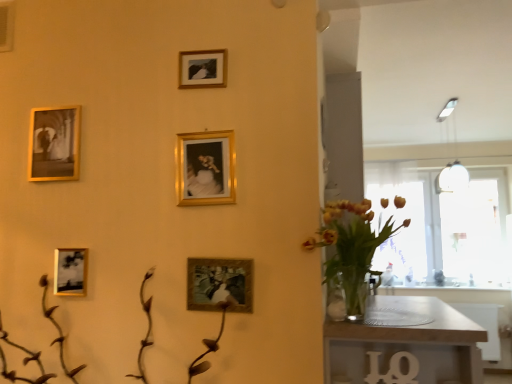
Question: Does gold metallic picture frame at center, the second picture frame positioned from the right, lie in front of matte gold picture frame at lower left, which is counted as the second picture frame, starting from the left?

Choices:
 (A) no
 (B) yes

Answer: (B)

Question: From a real-world perspective, is gold metallic picture frame at center, the 3th picture frame when ordered from bottom to top, located higher than matte gold picture frame at lower left, the 4th picture frame when ordered from right to left?

Choices:
 (A) yes
 (B) no

Answer: (A)

Question: Does gold metallic picture frame at center, the 4th picture frame positioned from the left, have a larger size compared to matte gold picture frame at lower left, which is counted as the second picture frame, starting from the left?

Choices:
 (A) yes
 (B) no

Answer: (A)

Question: From the image's perspective, is gold metallic picture frame at center, the 3th picture frame when ordered from bottom to top, beneath matte gold picture frame at lower left, which ranks as the second picture frame in bottom-to-top order?

Choices:
 (A) yes
 (B) no

Answer: (B)

Question: Is gold metallic picture frame at center, which appears as the 3th picture frame when viewed from the top, oriented towards matte gold picture frame at lower left, the 4th picture frame when ordered from right to left?

Choices:
 (A) yes
 (B) no

Answer: (B)

Question: Looking at their shapes, would you say transparent glass door at right is wider or thinner than matte gold picture frame at center, which is counted as the 1th picture frame, starting from the bottom?

Choices:
 (A) wide
 (B) thin

Answer: (A)

Question: Is transparent glass door at right spatially inside matte gold picture frame at center, the 5th picture frame positioned from the top, or outside of it?

Choices:
 (A) outside
 (B) inside

Answer: (A)

Question: In terms of size, does transparent glass door at right appear bigger or smaller than matte gold picture frame at center, which is the fifth picture frame from left to right?

Choices:
 (A) big
 (B) small

Answer: (A)

Question: Considering the positions of point (387, 215) and point (208, 301), is point (387, 215) closer or farther from the camera than point (208, 301)?

Choices:
 (A) closer
 (B) farther

Answer: (B)

Question: Considering the relative positions of transparent glass door at right and gold-framed picture at upper center, the 1th picture frame when ordered from top to bottom, in the image provided, is transparent glass door at right to the left or to the right of gold-framed picture at upper center, the 1th picture frame when ordered from top to bottom,?

Choices:
 (A) left
 (B) right

Answer: (B)

Question: In terms of width, does transparent glass door at right look wider or thinner when compared to gold-framed picture at upper center, the 5th picture frame ordered from the bottom?

Choices:
 (A) thin
 (B) wide

Answer: (B)

Question: From a real-world perspective, is transparent glass door at right physically located above or below gold-framed picture at upper center, marked as the 3th picture frame in a left-to-right arrangement?

Choices:
 (A) below
 (B) above

Answer: (A)

Question: Is transparent glass door at right spatially inside gold-framed picture at upper center, the 5th picture frame ordered from the bottom, or outside of it?

Choices:
 (A) outside
 (B) inside

Answer: (A)

Question: From a real-world perspective, is matte gold picture frame at center, which is counted as the 1th picture frame, starting from the bottom, above or below gold-framed picture at upper center, the 5th picture frame ordered from the bottom?

Choices:
 (A) above
 (B) below

Answer: (B)

Question: From the image's perspective, is matte gold picture frame at center, which is the fifth picture frame from left to right, positioned above or below gold-framed picture at upper center, marked as the 3th picture frame in a left-to-right arrangement?

Choices:
 (A) below
 (B) above

Answer: (A)